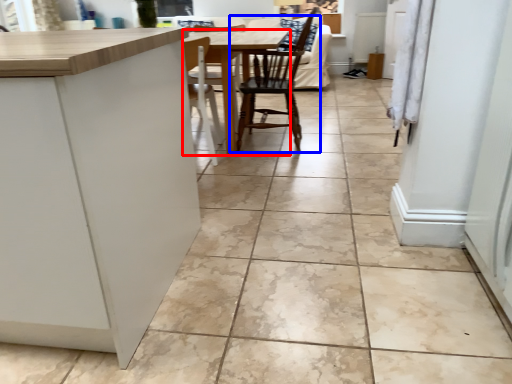
Question: Among these objects, which one is farthest to the camera, table (highlighted by a red box) or chair (highlighted by a blue box)?

Choices:
 (A) table
 (B) chair

Answer: (B)